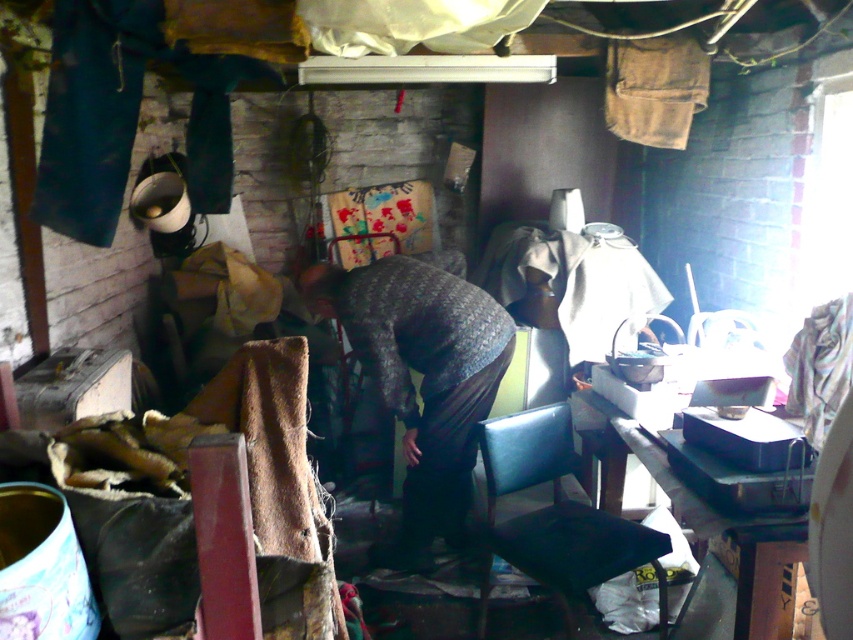
In the scene shown: Is knitted fabric sweater at center above black plastic table at lower right?

Yes, knitted fabric sweater at center is above black plastic table at lower right.

Between knitted fabric sweater at center and black plastic table at lower right, which one appears on the left side from the viewer's perspective?

From the viewer's perspective, knitted fabric sweater at center appears more on the left side.

Who is more forward, (457,308) or (738,612)?

Point (738,612) is more forward.

At what (x,y) coordinates should I click in order to perform the action: click on knitted fabric sweater at center. Please return your answer as a coordinate pair (x, y). The height and width of the screenshot is (640, 853). Looking at the image, I should click on (422, 378).

Can you confirm if knitted fabric sweater at center is bigger than black leather chair at lower center?

Correct, knitted fabric sweater at center is larger in size than black leather chair at lower center.

Between knitted fabric sweater at center and black leather chair at lower center, which one is positioned lower?

black leather chair at lower center

Is point (404, 324) positioned in front of point (590, 580)?

No, it is behind (590, 580).

Where is `knitted fabric sweater at center`? The width and height of the screenshot is (853, 640). knitted fabric sweater at center is located at coordinates (422, 378).

Can you confirm if black leather chair at lower center is thinner than black plastic table at lower right?

No.

Measure the distance between black leather chair at lower center and black plastic table at lower right.

black leather chair at lower center is 13.54 inches from black plastic table at lower right.

Find the location of a particular element. black leather chair at lower center is located at coordinates (555, 516).